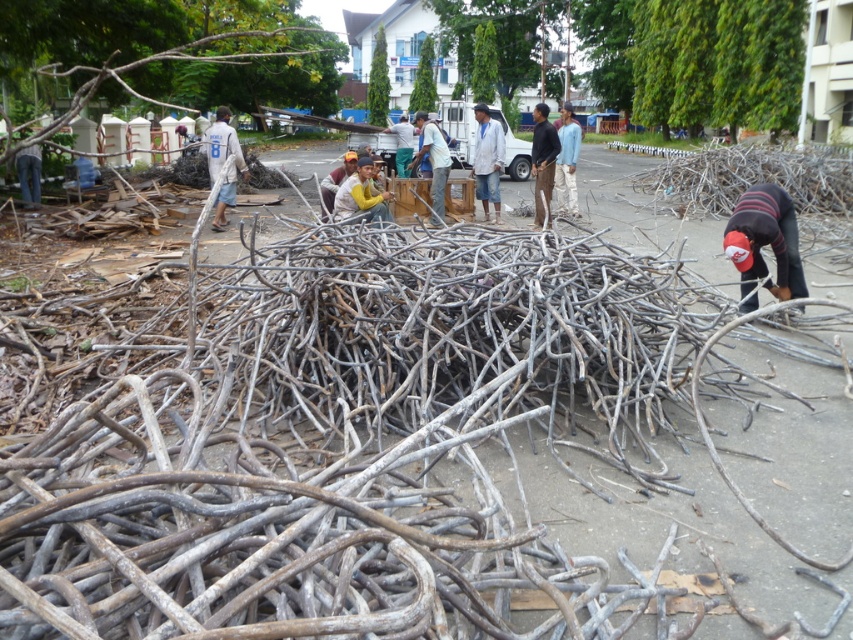
You are a photographer trying to capture the striped knit cap at lower right and the white fabric shirt at center in the same frame. Which object should you focus on first if you want to ensure both are in focus without adjusting your camera settings?

The striped knit cap at lower right has a smaller size compared to the white fabric shirt at center. Therefore, focusing on the white fabric shirt at center first would allow the striped knit cap at lower right to fall within the depth of field, ensuring both are in focus.

You are standing in the outdoor scene and see the gray wood tree branch at upper left and the light blue fabric shirt at center. Which object is positioned to the left of the other?

The gray wood tree branch at upper left is positioned to the left of the light blue fabric shirt at center.